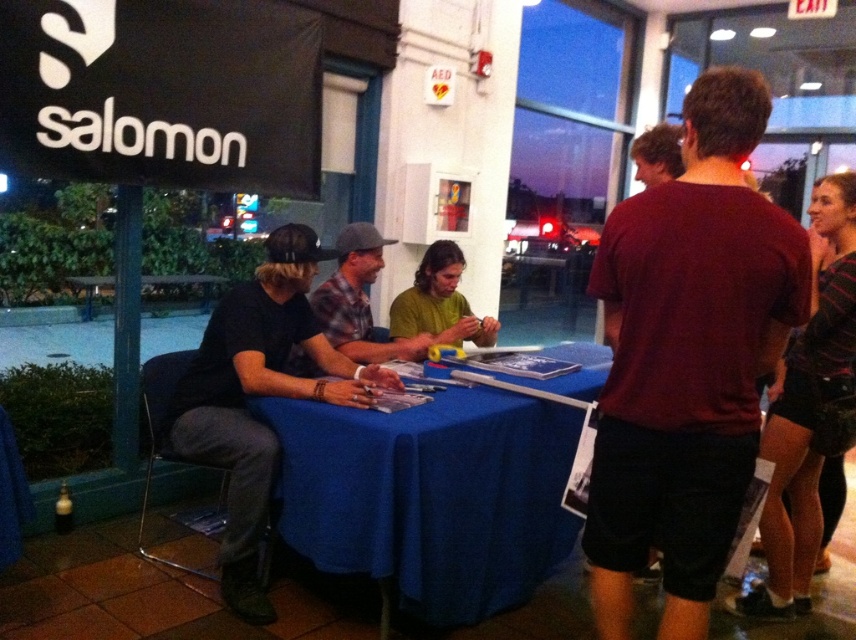
You are attending a Salomon event and notice two shirts at the center of the table. The matte black shirt at center and the green matte shirt at center. Which shirt is placed lower on the table?

The matte black shirt at center is positioned under the green matte shirt at center, so the matte black shirt at center is placed lower on the table.